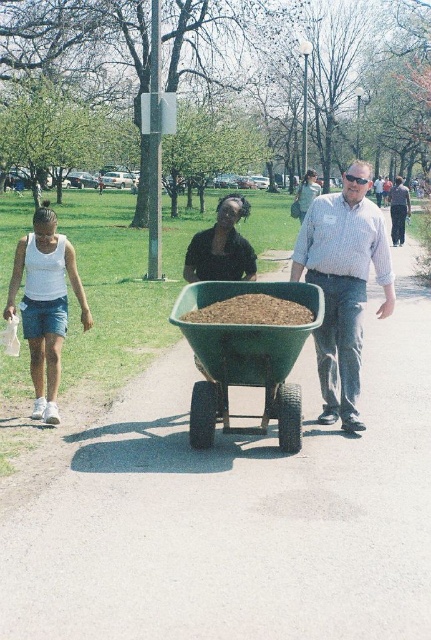
Question: Can you confirm if green plastic cart at center is positioned to the left of green fabric dress at center?

Choices:
 (A) yes
 (B) no

Answer: (A)

Question: Does green plastic wheelbarrow at center appear on the right side of matte black shirt at center?

Choices:
 (A) yes
 (B) no

Answer: (A)

Question: Which object is closer to the camera taking this photo?

Choices:
 (A) green fabric dress at center
 (B) green plastic wheelbarrow at center

Answer: (B)

Question: Based on their relative distances, which object is nearer to the matte black shirt at center?

Choices:
 (A) dark blue jeans at center
 (B) green fabric dress at center
 (C) green plastic wheelbarrow at center
 (D) white matte tank top at left

Answer: (D)

Question: Which of the following is the farthest from the observer?

Choices:
 (A) (287, 358)
 (B) (34, 252)
 (C) (402, 188)

Answer: (C)

Question: In this image, where is matte blue shirt at center located relative to green plastic cart at center?

Choices:
 (A) left
 (B) right

Answer: (B)